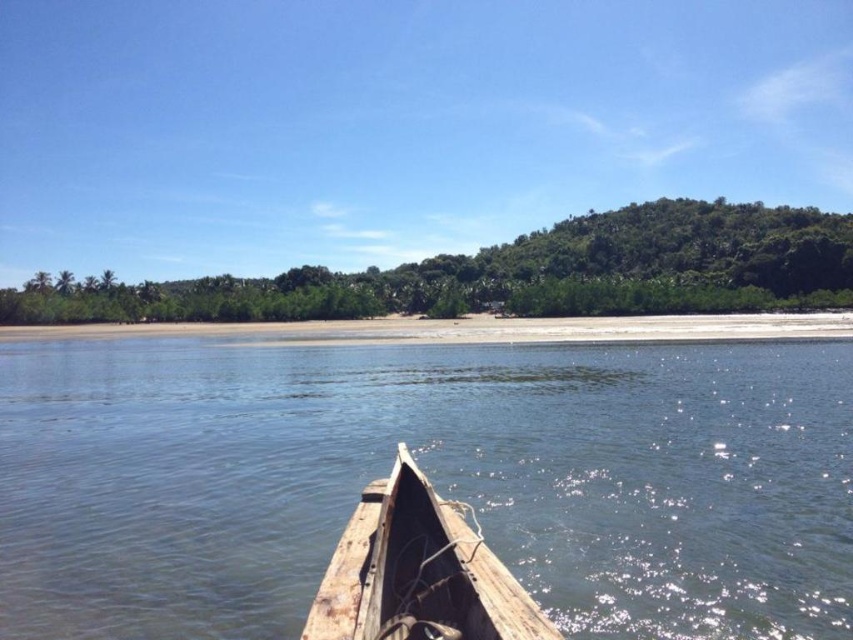
Is point (294, 456) more distant than point (434, 337)?

No, (294, 456) is in front of (434, 337).

Can you confirm if wooden boat at lower center is wider than sandy beach at lower center?

No, wooden boat at lower center is not wider than sandy beach at lower center.

Does point (366, 394) lie in front of point (490, 321)?

That is True.

You are a GUI agent. You are given a task and a screenshot of the screen. Output one action in this format:
    pyautogui.click(x=<x>, y=<y>)
    Task: Click on the wooden boat at lower center
    The height and width of the screenshot is (640, 853).
    Given the screenshot: What is the action you would take?
    pyautogui.click(x=428, y=477)

Is weathered wood boat at lower center smaller than sandy beach at lower center?

Yes, weathered wood boat at lower center is smaller than sandy beach at lower center.

Image resolution: width=853 pixels, height=640 pixels. I want to click on weathered wood boat at lower center, so click(418, 572).

Which is above, wooden boat at lower center or weathered wood boat at lower center?

wooden boat at lower center

Measure the distance between wooden boat at lower center and camera.

7.66 meters

The width and height of the screenshot is (853, 640). Find the location of `wooden boat at lower center`. wooden boat at lower center is located at coordinates (428, 477).